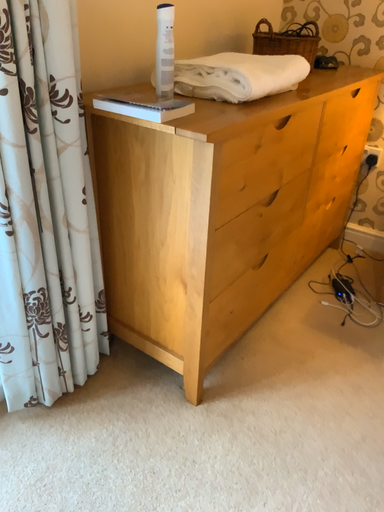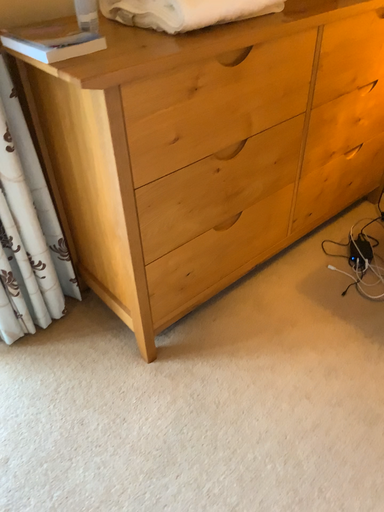
Question: How did the camera likely rotate when shooting the video?

Choices:
 (A) rotated left
 (B) rotated right

Answer: (A)